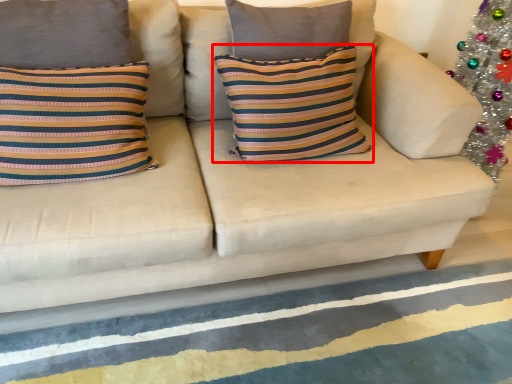
Question: From the image's perspective, what is the correct spatial positioning of pillow (annotated by the red box) in reference to stripe?

Choices:
 (A) above
 (B) below

Answer: (A)